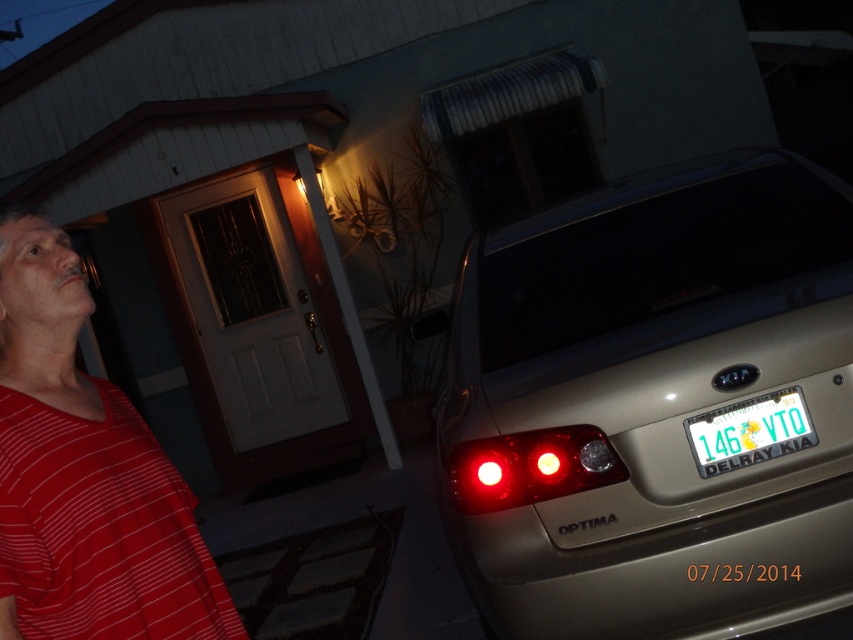
You are a delivery person standing at the camera position. You need to place a package that is 10 feet long on the ground between the gold metallic car at right and the house. Is there enough space?

The gold metallic car at right is 8.06 feet from camera. Since the package is 10 feet long, there isn not enough space between the gold metallic car at right and the house to place it.

You are a delivery person approaching the house at night. You see the gold metallic car at right and the red glass light at center. Which object is closer to the front door?

The red glass light at center is closer to the front door because the gold metallic car at right is to the right of the red glass light at center, placing it farther away from the door.

You are a delivery driver who needs to park your gold metallic car at right in the driveway without blocking the red translucent light at center. Based on the scene, can your car fit in the driveway without covering the light?

The gold metallic car at right is larger in size compared to the red translucent light at center. Since the car is bigger, it might block the light if parked improperly. However, the exact positioning depends on the driveway space not described here.